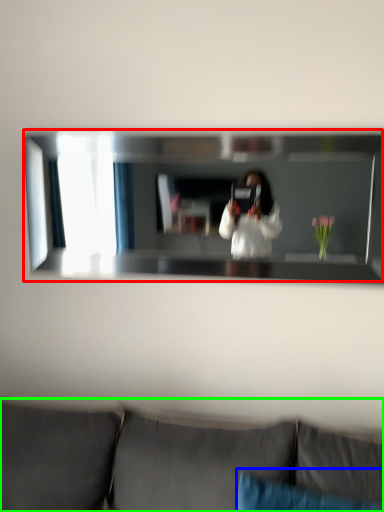
Question: Estimate the real-world distances between objects in this image. Which object is closer to mirror (highlighted by a red box), pillow (highlighted by a blue box) or studio couch (highlighted by a green box)?

Choices:
 (A) pillow
 (B) studio couch

Answer: (B)